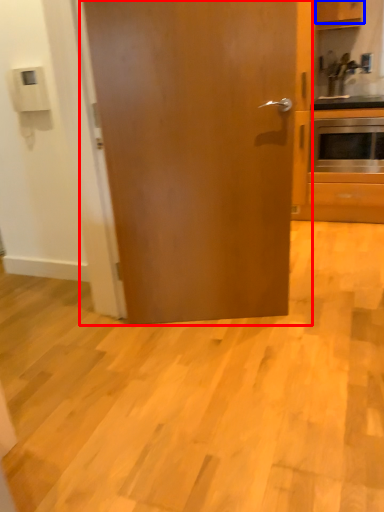
Question: Which point is closer to the camera, door (highlighted by a red box) or cabinetry (highlighted by a blue box)?

Choices:
 (A) door
 (B) cabinetry

Answer: (A)